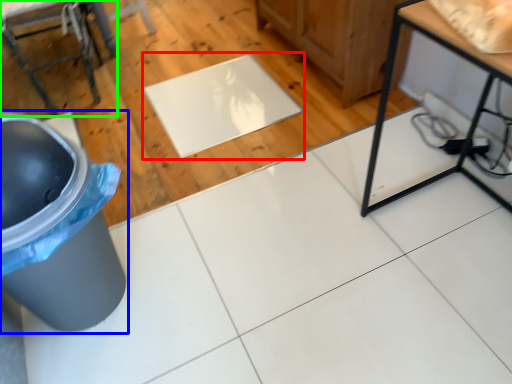
Question: Based on their relative distances, which object is nearer to mat (highlighted by a red box)? Choose from waste container (highlighted by a blue box) and furniture (highlighted by a green box).

Choices:
 (A) waste container
 (B) furniture

Answer: (B)